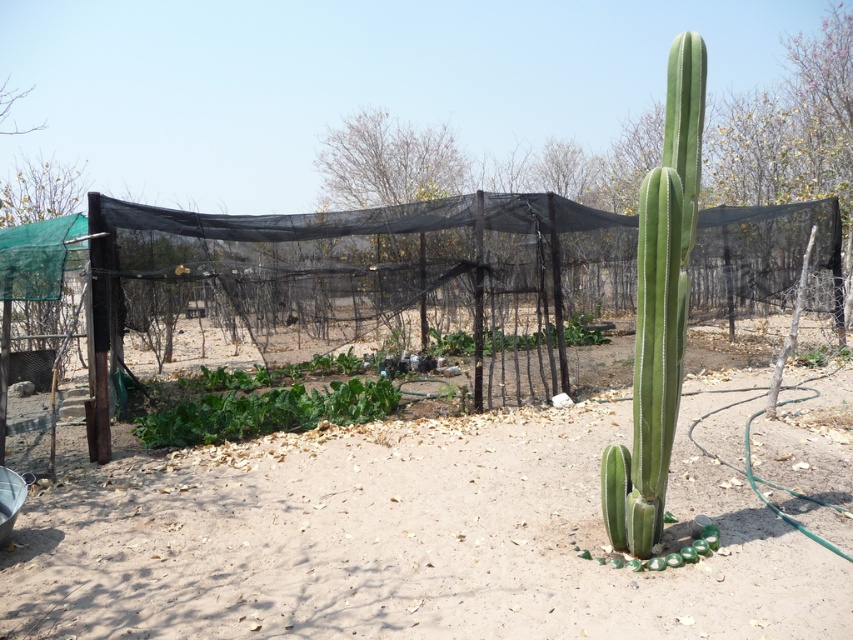
You are a gardener who wants to plant a new flower in the garden. You see the dirt at center and the green leafy at center. Which area is lower in elevation and better for digging?

The dirt at center has a lesser height compared to green leafy at center, so it is lower in elevation and better for digging.

You are a gardener looking at the garden scene. You see the green leafy at center and the green leafy plant at center. Which one is closer to you?

The green leafy at center is closer to you because it is in front of the green leafy plant at center.